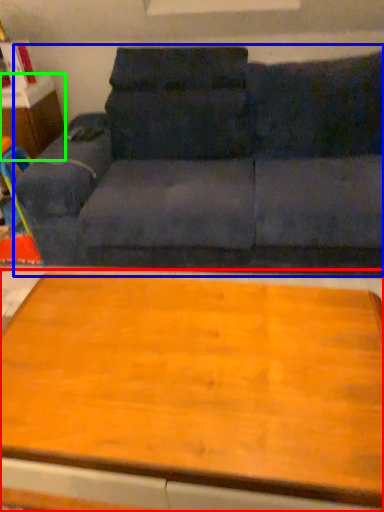
Question: Which is farther away from table (highlighted by a red box)? studio couch (highlighted by a blue box) or dresser (highlighted by a green box)?

Choices:
 (A) studio couch
 (B) dresser

Answer: (B)